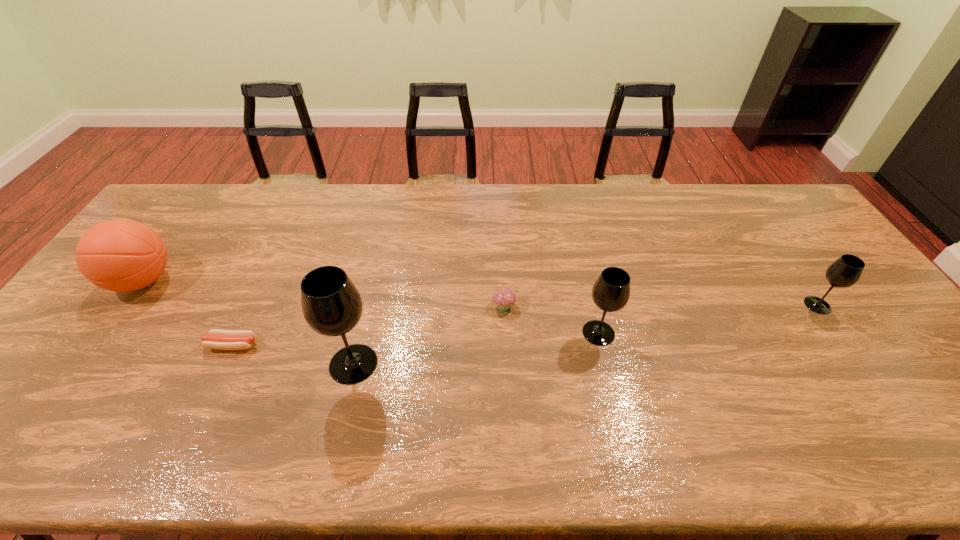
The width and height of the screenshot is (960, 540). What are the coordinates of `free location that satisfies the following two spatial constraints: 1. on the back side of the farthest wineglass; 2. on the left side of the tallest object` in the screenshot? It's located at (367, 305).